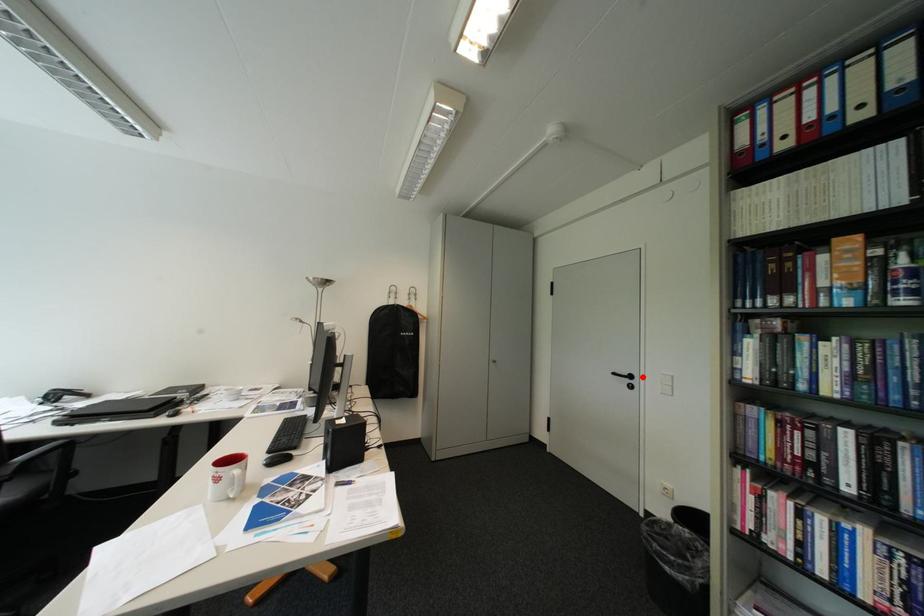
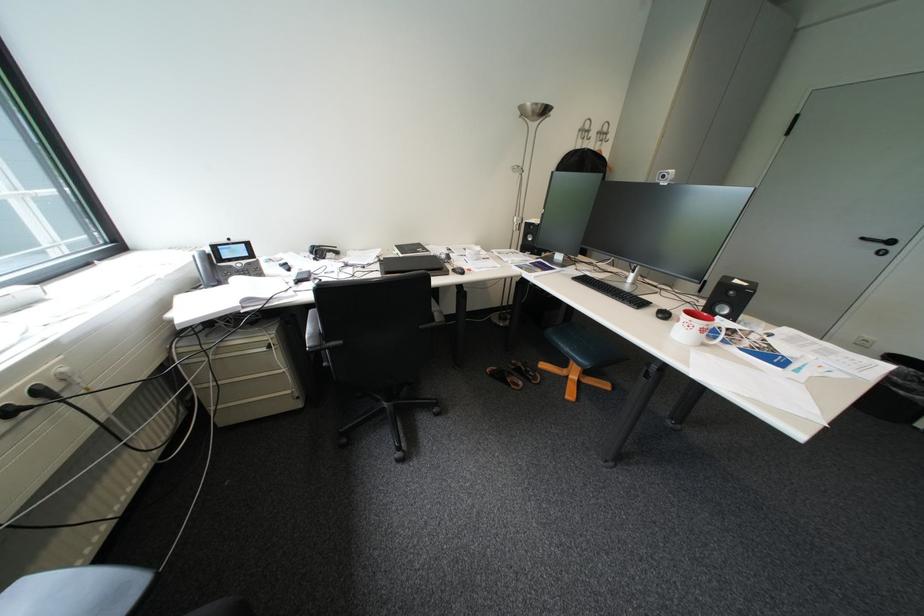
Locate, in the second image, the point that corresponds to the highlighted location in the first image.

(904, 243)